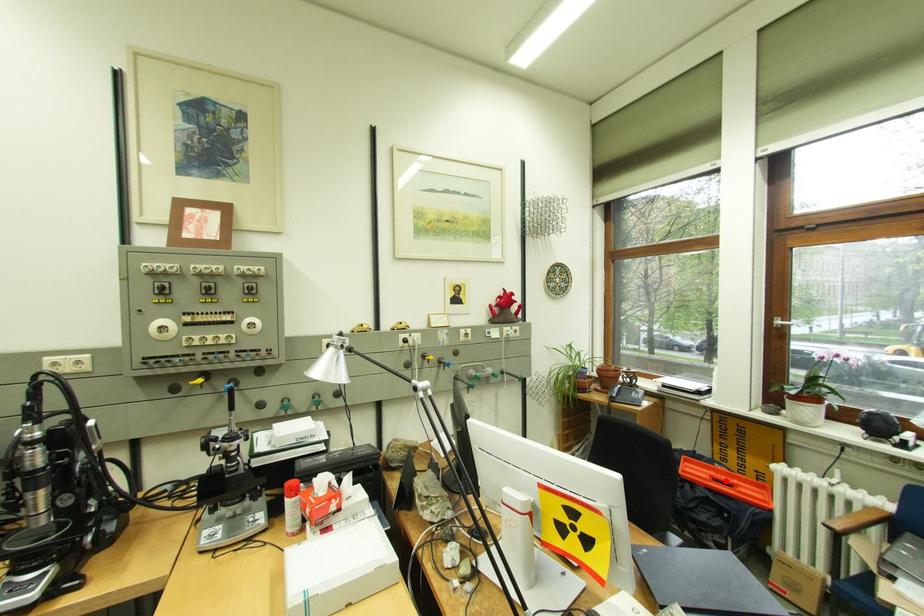
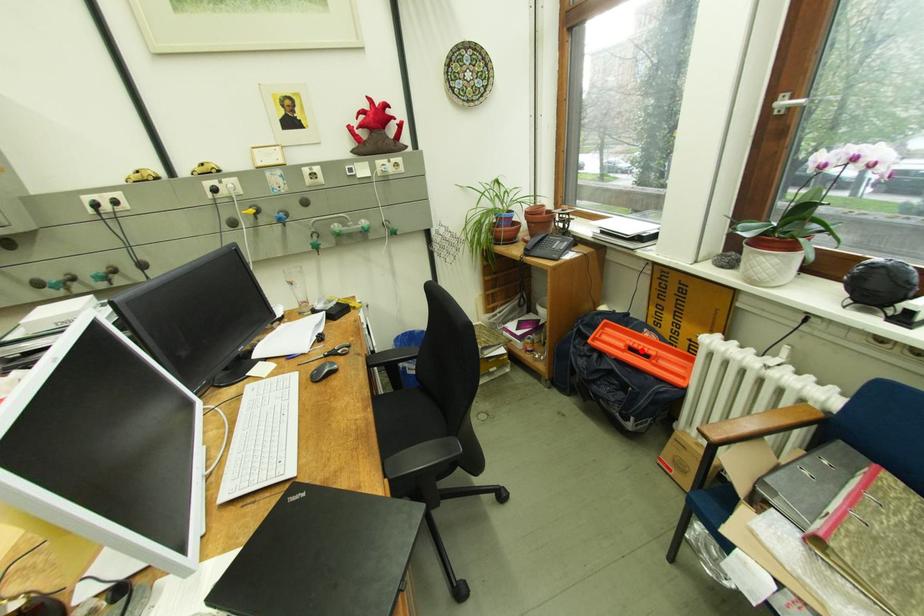
I am providing you with two images of the same scene from different viewpoints. A red point is marked on the first image and another point is marked on the second image. Does the point marked in image1 correspond to the same location as the one in image2?

Yes